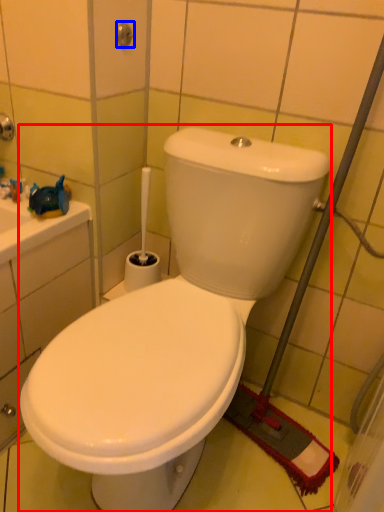
Question: Which of the following is the closest to the observer, toilet (highlighted by a red box) or shower (highlighted by a blue box)?

Choices:
 (A) toilet
 (B) shower

Answer: (A)